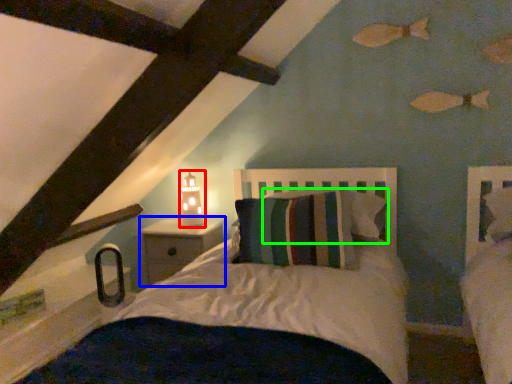
Question: Considering the real-world distances, which object is farthest from table lamp (highlighted by a red box)? nightstand (highlighted by a blue box) or pillow (highlighted by a green box)?

Choices:
 (A) nightstand
 (B) pillow

Answer: (B)